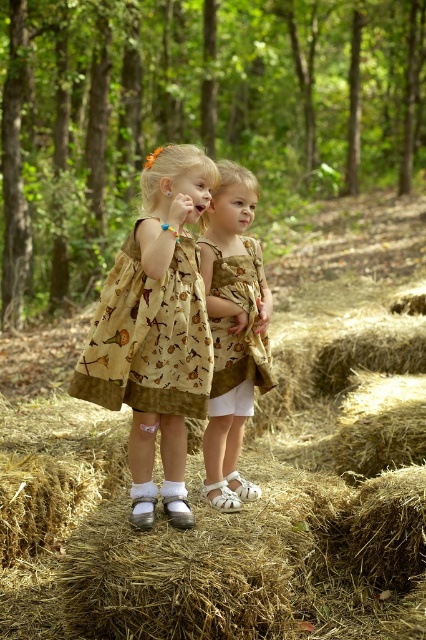
You are a photographer trying to focus on both the matte brown dress at center and the printed cotton dress at center. Which dress will appear sharper in the photo due to its position?

The matte brown dress at center will appear sharper in the photo because it is closer to the viewer, making it in focus compared to the printed cotton dress at center which is further away.

In the scene shown: You are a photographer trying to adjust the composition of the image to make both the yellow cotton dress at center and the matte brown dress at center appear equally prominent. Based on their current heights, what adjustment could you make?

The yellow cotton dress at center is shorter than the matte brown dress at center. To make them appear equally prominent, you could position the yellow cotton dress at center on a slightly elevated surface or angle the camera upward to compensate for its lesser height.